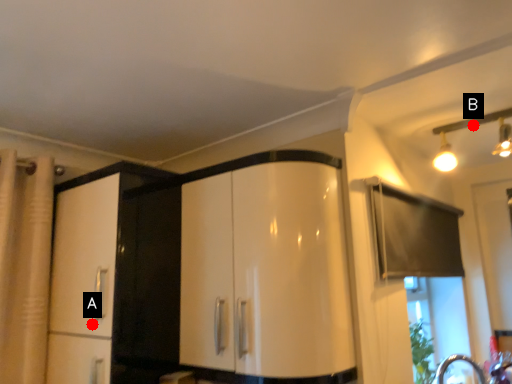
Question: Two points are circled on the image, labeled by A and B beside each circle. Which point is closer to the camera taking this photo?

Choices:
 (A) A is closer
 (B) B is closer

Answer: (A)